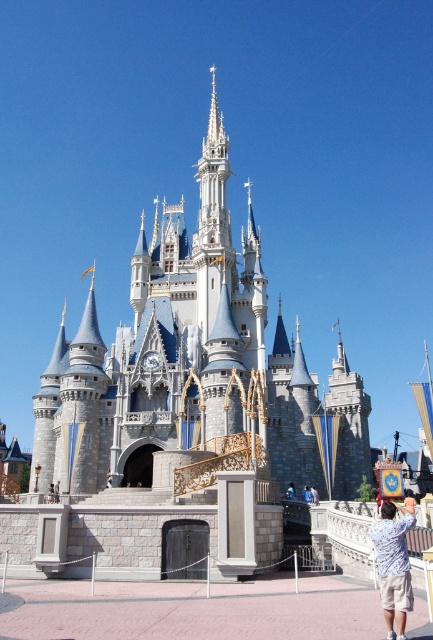
You are a visitor approaching the gray stone castle at center and notice a light blue shirt at lower right. Which object is wider?

The gray stone castle at center is wider than the light blue shirt at lower right.

You are a tourist visiting the castle and want to take a photo that includes both the gray stone castle at center and the light blue shirt at lower right. Since you want the castle to look more prominent in the photo, which object should you place closer to the camera?

The gray stone castle at center is bigger than the light blue shirt at lower right. To make the castle look more prominent, you should place the light blue shirt at lower right closer to the camera so that it appears larger in comparison, while keeping the gray stone castle at center at a distance to maintain its dominance in the frame.